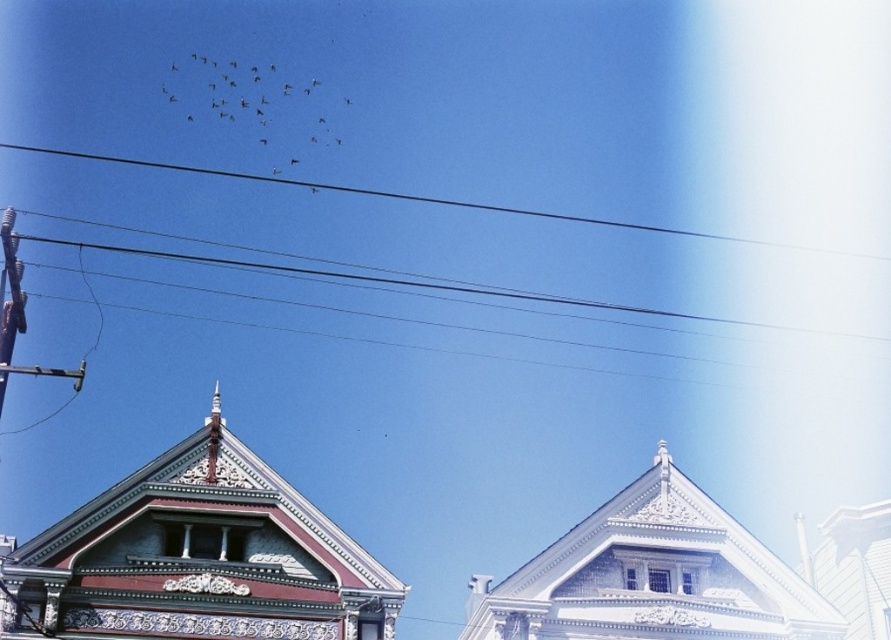
You are an architect designing a new Victorian house and are studying the image. You notice the dark gray feathers at upper center and the black wire at upper center. Which of these two objects is positioned higher in the scene?

The dark gray feathers at upper center is positioned higher in the scene than the black wire at upper center because it is much taller as black wire at upper center.

You are an ornithologist observing the scene. You notice dark gray feathers at upper center and black wire at upper center. Which object is positioned higher in the image?

The dark gray feathers at upper center is located above the black wire at upper center, so it is positioned higher.